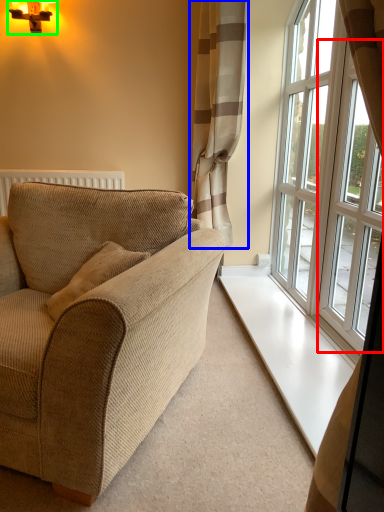
Question: Estimate the real-world distances between objects in this image. Which object is farther from window (highlighted by a red box), curtain (highlighted by a blue box) or light fixture (highlighted by a green box)?

Choices:
 (A) curtain
 (B) light fixture

Answer: (B)